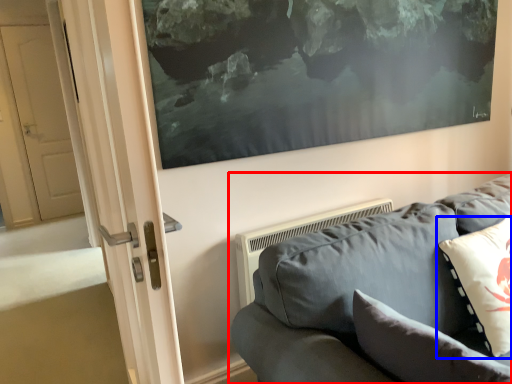
Question: Among these objects, which one is nearest to the camera, studio couch (highlighted by a red box) or pillow (highlighted by a blue box)?

Choices:
 (A) studio couch
 (B) pillow

Answer: (A)